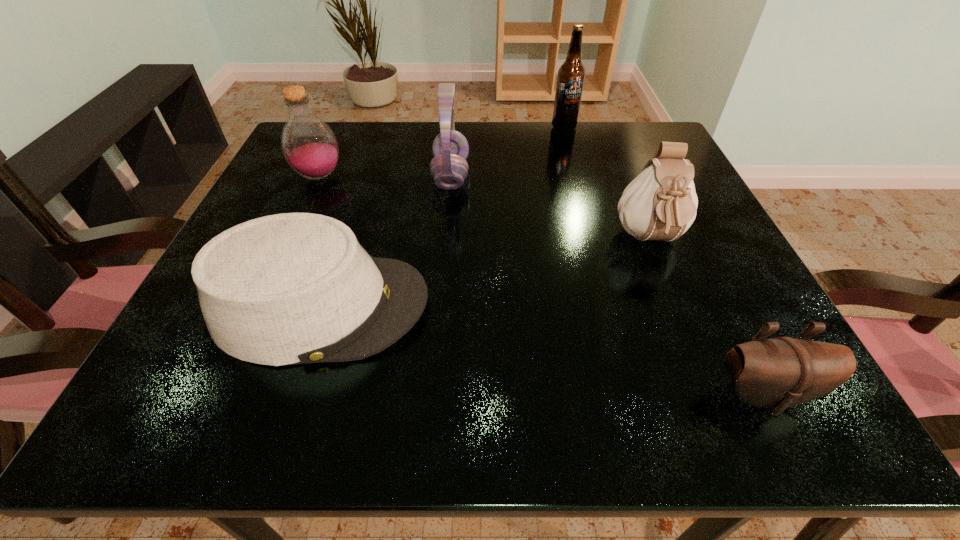
Where is `vacant space located 0.280m on the front of the bottle`? This screenshot has width=960, height=540. vacant space located 0.280m on the front of the bottle is located at coordinates (267, 292).

Where is `vacant area located on the front-facing side of the farther pouch`? This screenshot has width=960, height=540. vacant area located on the front-facing side of the farther pouch is located at coordinates (675, 302).

You are a GUI agent. You are given a task and a screenshot of the screen. Output one action in this format:
    pyautogui.click(x=<x>, y=<y>)
    Task: Click on the free space located 0.290m on the front-facing side of the hat
    The image size is (960, 540).
    Given the screenshot: What is the action you would take?
    pyautogui.click(x=612, y=306)

Where is `beer bottle positioned at the far edge`? The image size is (960, 540). beer bottle positioned at the far edge is located at coordinates (570, 80).

You are a GUI agent. You are given a task and a screenshot of the screen. Output one action in this format:
    pyautogui.click(x=<x>, y=<y>)
    Task: Click on the headset that is at the far edge
    This screenshot has width=960, height=540.
    Given the screenshot: What is the action you would take?
    pyautogui.click(x=449, y=168)

Where is `bottle located in the far edge section of the desktop`? The width and height of the screenshot is (960, 540). bottle located in the far edge section of the desktop is located at coordinates (310, 147).

Locate an element on the screen. The width and height of the screenshot is (960, 540). object that is at the near edge is located at coordinates (779, 373).

At what (x,y) coordinates should I click in order to perform the action: click on bottle at the left edge. Please return your answer as a coordinate pair (x, y). This screenshot has height=540, width=960. Looking at the image, I should click on (310, 147).

You are a GUI agent. You are given a task and a screenshot of the screen. Output one action in this format:
    pyautogui.click(x=<x>, y=<y>)
    Task: Click on the hat located in the left edge section of the desktop
    The height and width of the screenshot is (540, 960).
    Given the screenshot: What is the action you would take?
    pyautogui.click(x=294, y=288)

At what (x,y) coordinates should I click in order to perform the action: click on object present at the far left corner. Please return your answer as a coordinate pair (x, y). The height and width of the screenshot is (540, 960). Looking at the image, I should click on (310, 147).